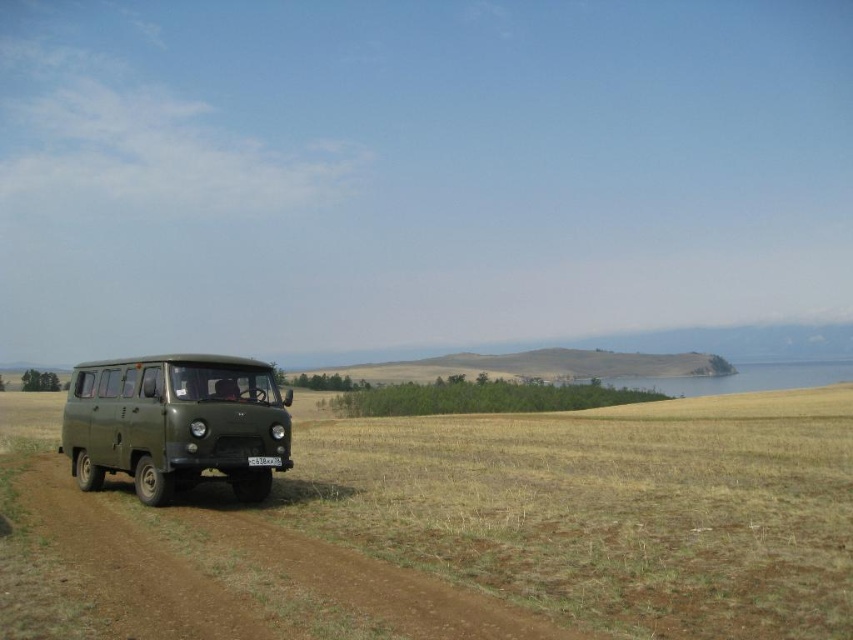
Consider the image. You are a delivery driver who needs to turn around your vehicle on the brown dirt track at lower left. Considering the matte green van at left is parked there, can you safely maneuver your vehicle without hitting the van?

The brown dirt track at lower left is wider than the matte green van at left, so yes, you can safely maneuver your vehicle without hitting the van as there is enough space.

You are a hiker standing at the edge of the brown dirt track at lower left and want to reach the matte green van at left. Which direction should you move to get closer to the van?

Since the brown dirt track at lower left has a lesser height compared to the matte green van at left, you should move towards the higher ground in the direction of the matte green van at left to get closer.

You are a hiker who wants to reach the black plastic license plate at center. You are currently standing on the brown dirt track at lower left. Which direction should you walk to get to the license plate?

The brown dirt track at lower left is positioned on the left side of the black plastic license plate at center, so you should walk to the right to reach the license plate.